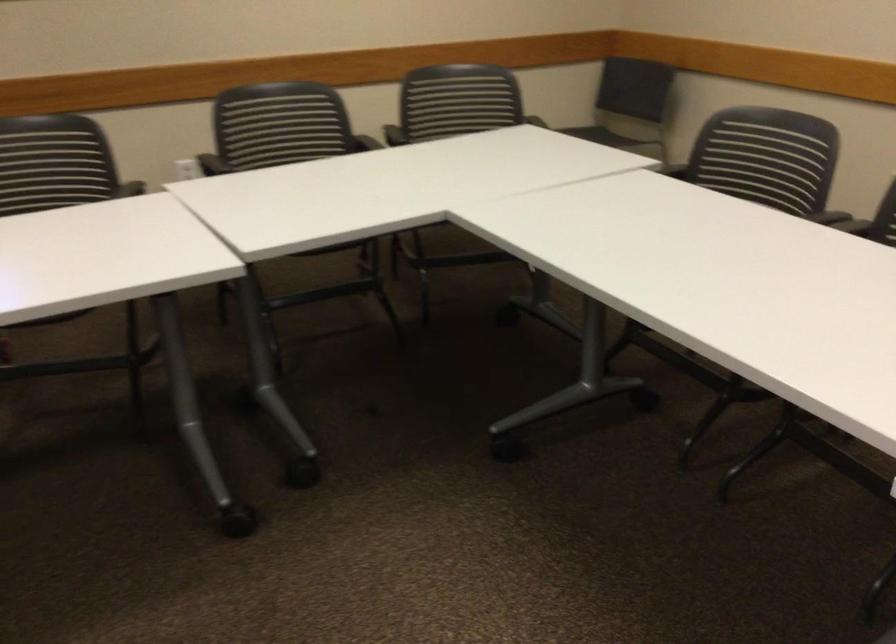
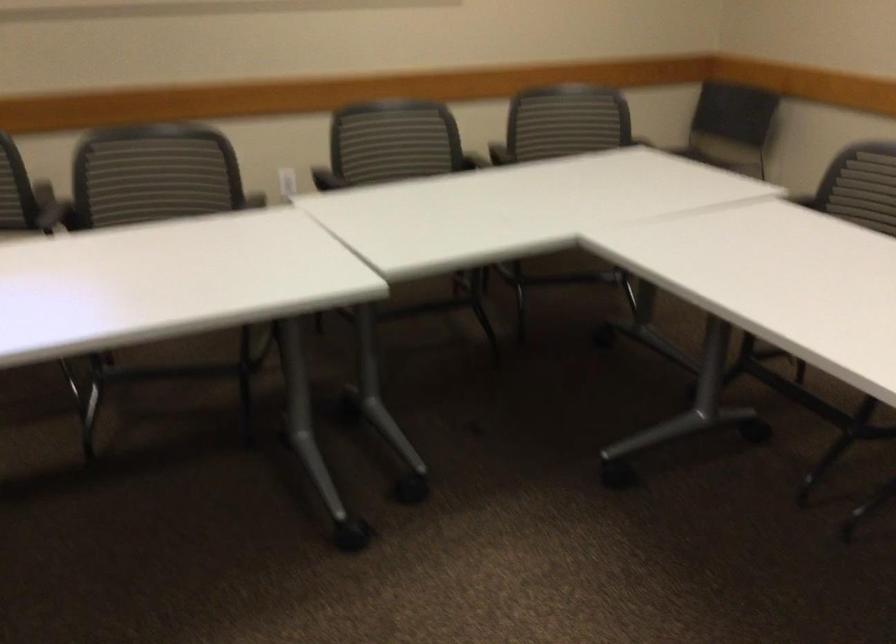
In the second image, find the point that corresponds to point 728,158 in the first image.

(866, 185)